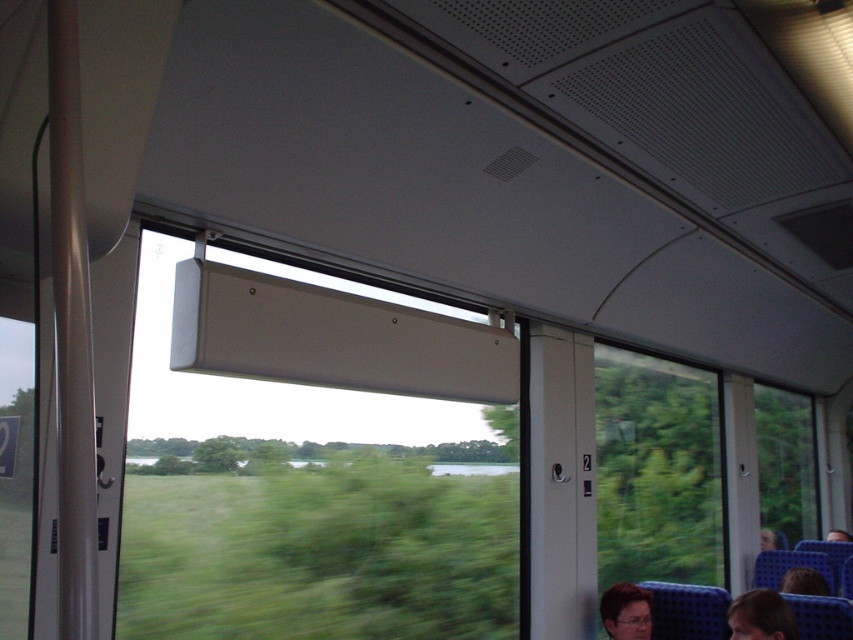
Is white matte window at center below blue fabric headrest at lower right?

No.

Does point (453, 458) come in front of point (827, 538)?

Yes.

Is point (294, 513) less distant than point (827, 536)?

Yes, point (294, 513) is closer to viewer.

What are the coordinates of `white matte window at center` in the screenshot? It's located at (306, 502).

From the picture: Does green matte window at right appear on the left side of dark brown hair at lower right?

Yes, green matte window at right is to the left of dark brown hair at lower right.

Does green matte window at right have a larger size compared to dark brown hair at lower right?

Correct, green matte window at right is larger in size than dark brown hair at lower right.

Between point (614, 472) and point (801, 570), which one is positioned in front?

Positioned in front is point (801, 570).

Find the location of a particular element. This screenshot has width=853, height=640. green matte window at right is located at coordinates (656, 470).

Is point (347, 476) more distant than point (633, 600)?

No, (347, 476) is in front of (633, 600).

Is point (292, 554) in front of point (640, 605)?

Yes, point (292, 554) is closer to viewer.

Where is `white matte window at center`? white matte window at center is located at coordinates (306, 502).